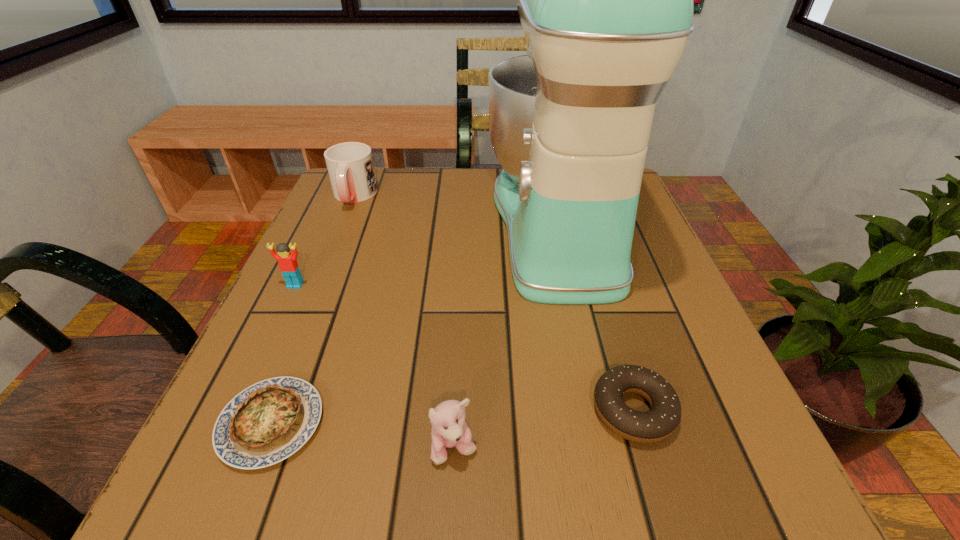
The width and height of the screenshot is (960, 540). In order to click on quiche positioned at the left edge in this screenshot , I will do `click(269, 421)`.

Locate an element on the screen. mixer present at the right edge is located at coordinates (605, 0).

Identify the location of doughnut located at the right edge. (658, 423).

Where is `object that is at the far left corner`? The height and width of the screenshot is (540, 960). object that is at the far left corner is located at coordinates (350, 166).

Image resolution: width=960 pixels, height=540 pixels. I want to click on object that is at the near left corner, so click(x=269, y=421).

Find the location of `object located at the far right corner`. object located at the far right corner is located at coordinates (605, 0).

I want to click on object situated at the near right corner, so click(x=658, y=423).

At what (x,y) coordinates should I click in order to perform the action: click on free space at the near edge. Please return your answer as a coordinate pair (x, y). Looking at the image, I should click on (590, 501).

The height and width of the screenshot is (540, 960). In order to click on free space at the left edge of the desktop in this screenshot , I will do (367, 290).

The width and height of the screenshot is (960, 540). In the image, there is a desktop. In order to click on free space at the right edge in this screenshot , I will do `click(653, 281)`.